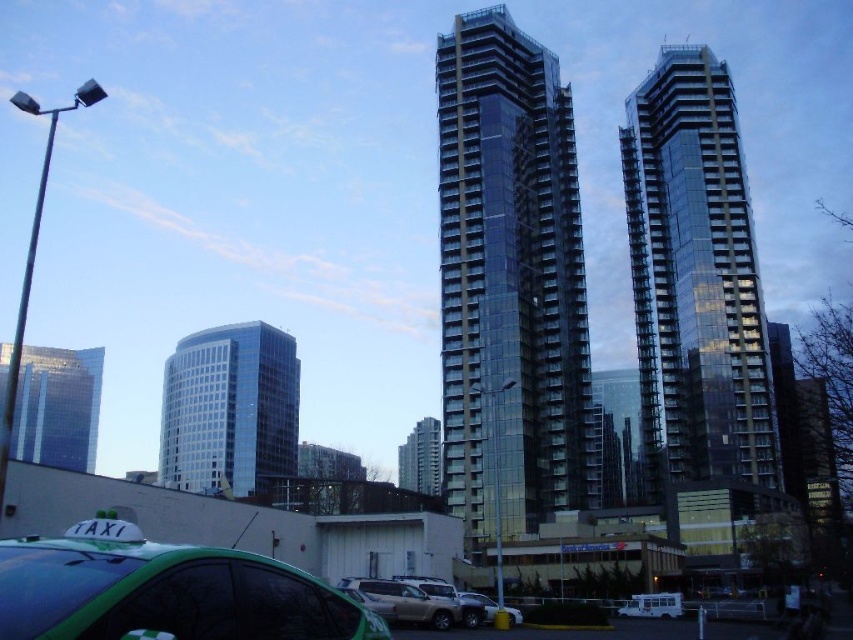
Question: Which object is farther from the camera taking this photo?

Choices:
 (A) matte silver suv at center
 (B) metallic silver suv at center
 (C) green matte taxi at lower left
 (D) glassy metallic building at center

Answer: (D)

Question: Is glassy steel skyscraper at center wider than matte silver suv at center?

Choices:
 (A) no
 (B) yes

Answer: (B)

Question: Among these objects, which one is nearest to the camera?

Choices:
 (A) glassy metallic building at center
 (B) glassy reflective skyscraper at left
 (C) metallic silver suv at center
 (D) matte silver suv at center

Answer: (B)

Question: Can you confirm if green matte taxi at lower left is smaller than glassy metallic building at center?

Choices:
 (A) no
 (B) yes

Answer: (B)

Question: Which of the following is the closest to the observer?

Choices:
 (A) 672,307
 (B) 508,611

Answer: (B)

Question: In this image, where is green matte taxi at lower left located relative to metallic silver suv at center?

Choices:
 (A) below
 (B) above

Answer: (B)